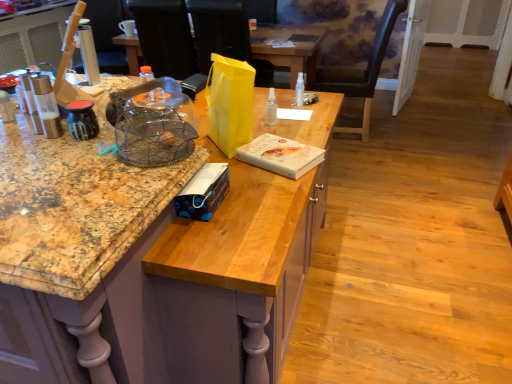
Identify the location of free space in front of black leather chair at upper right. (377, 156).